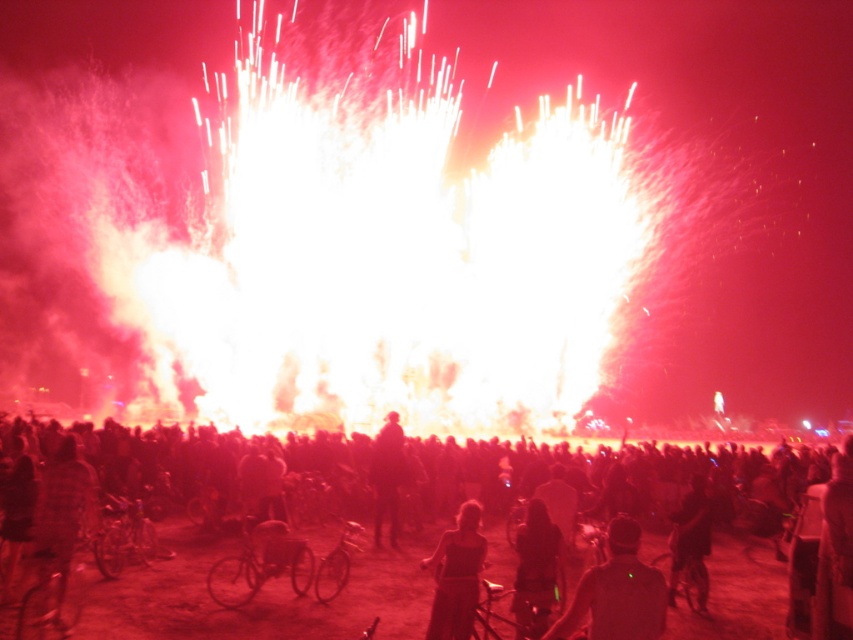
Does silhouette of person at center have a larger size compared to dark hair at center?

Indeed, silhouette of person at center has a larger size compared to dark hair at center.

This screenshot has width=853, height=640. I want to click on silhouette of person at center, so click(312, 550).

Who is more forward, (248, 442) or (654, 605)?

Point (654, 605)

This screenshot has width=853, height=640. I want to click on silhouette of person at center, so click(312, 550).

Is point (608, 618) closer to camera compared to point (389, 477)?

Yes, it is.

Which is more to the left, dark hair at center or silhouette figure at center?

silhouette figure at center

Where is `dark hair at center`? This screenshot has height=640, width=853. dark hair at center is located at coordinates (618, 592).

Where is `dark hair at center`? This screenshot has height=640, width=853. dark hair at center is located at coordinates (618, 592).

Consider the image. Which is above, dark hair at center or matte black dress at center?

matte black dress at center is higher up.

Between point (589, 636) and point (482, 561), which one is positioned behind?

Point (482, 561)

This screenshot has height=640, width=853. Identify the location of dark hair at center. (618, 592).